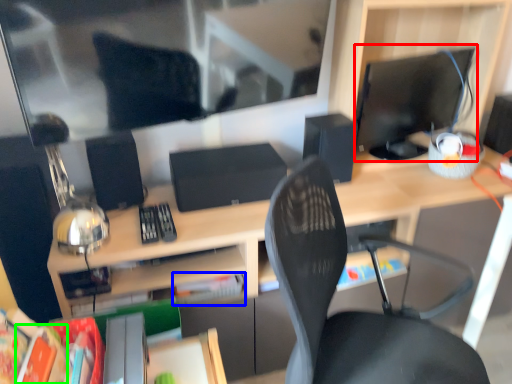
Question: Estimate the real-world distances between objects in this image. Which object is closer to computer monitor (highlighted by a red box), paperback book (highlighted by a blue box) or paperback book (highlighted by a green box)?

Choices:
 (A) paperback book
 (B) paperback book

Answer: (A)